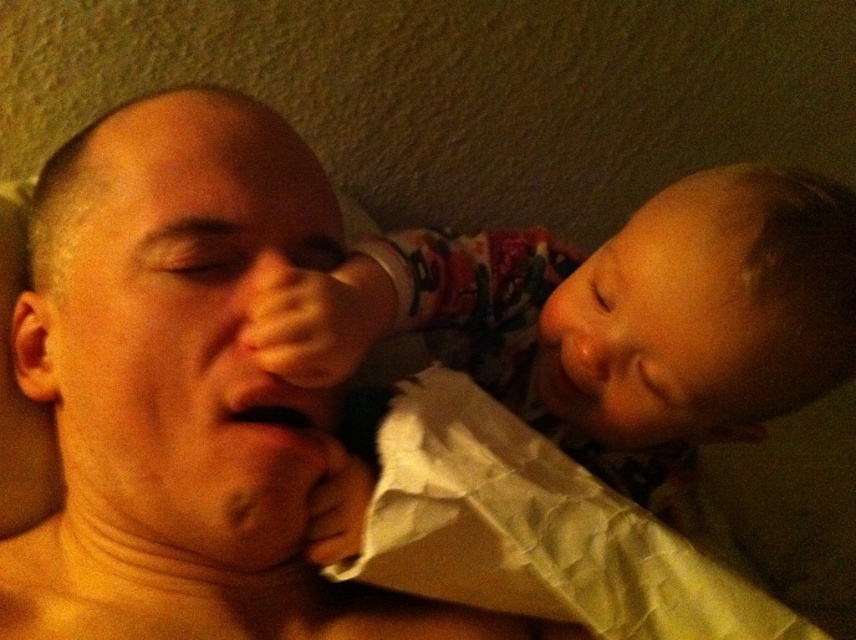
Question: Which of the following is the closest to the observer?

Choices:
 (A) white crumpled paper at lower center
 (B) soft pink fabric at upper right

Answer: (B)

Question: Can you confirm if soft pink fabric at upper right is thinner than white crumpled paper at lower center?

Choices:
 (A) no
 (B) yes

Answer: (A)

Question: Which point appears closest to the camera in this image?

Choices:
 (A) tap(621, 624)
 (B) tap(550, 266)

Answer: (A)

Question: Can you confirm if skinny white shirt at center is wider than soft pink fabric at upper right?

Choices:
 (A) no
 (B) yes

Answer: (A)

Question: Which point is closer to the camera?

Choices:
 (A) (84, 522)
 (B) (708, 301)
 (C) (444, 490)

Answer: (C)

Question: Can you confirm if soft pink fabric at upper right is positioned below white crumpled paper at lower center?

Choices:
 (A) yes
 (B) no

Answer: (B)